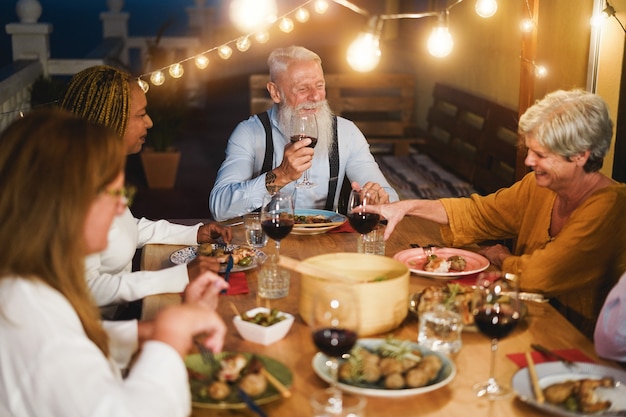
Where is `plate with food on it`? plate with food on it is located at coordinates (372, 346), (245, 371), (558, 376), (449, 251), (468, 301), (322, 211), (235, 250).